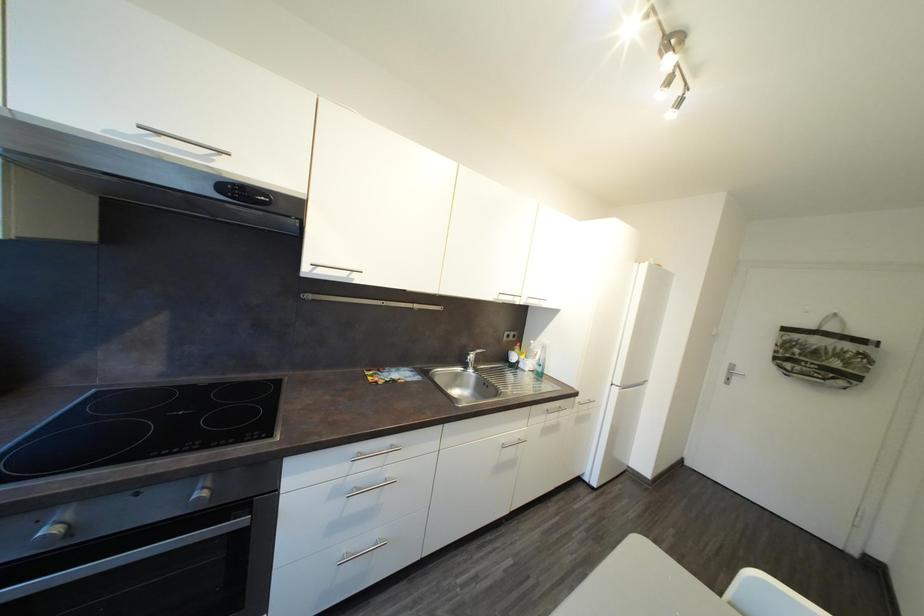
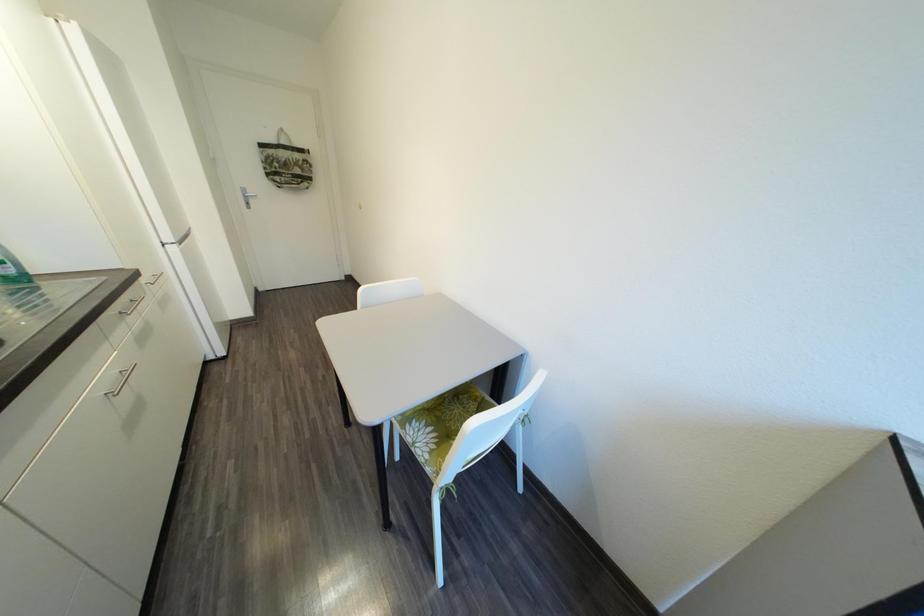
Based on the continuous images, in which direction is the camera rotating?

The rotation direction of the camera is right-down.